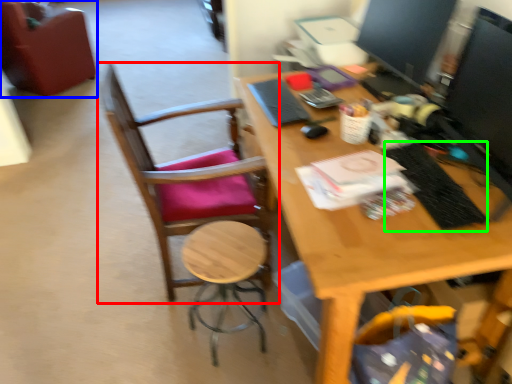
Question: Which object is positioned farthest from chair (highlighted by a red box)? Select from chair (highlighted by a blue box) and laptop keyboard (highlighted by a green box).

Choices:
 (A) chair
 (B) laptop keyboard

Answer: (A)